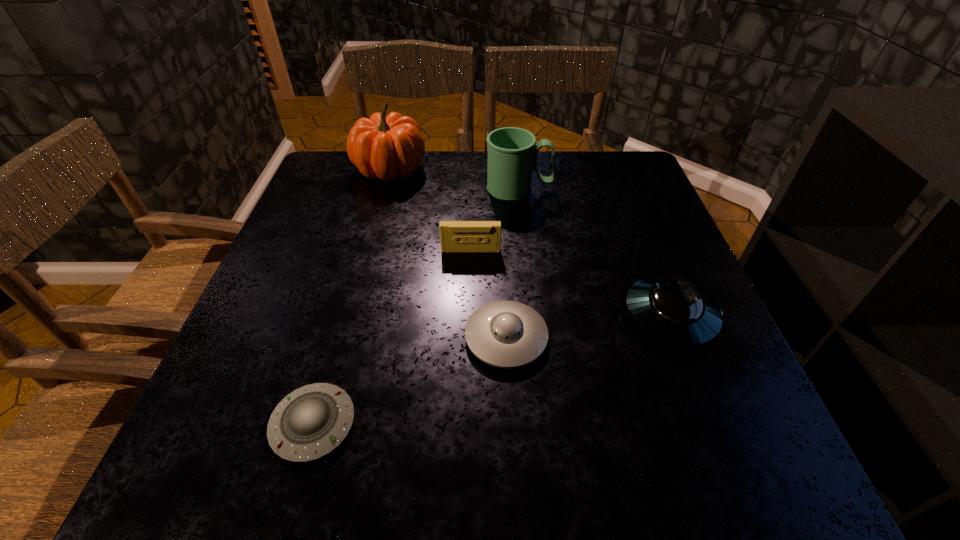
Find the location of a particular element. The width and height of the screenshot is (960, 540). saucer located at the left edge is located at coordinates (310, 422).

Where is `object positioned at the right edge`? This screenshot has height=540, width=960. object positioned at the right edge is located at coordinates (673, 309).

The height and width of the screenshot is (540, 960). I want to click on object present at the far left corner, so click(x=382, y=147).

This screenshot has height=540, width=960. I want to click on object that is positioned at the near left corner, so click(x=310, y=422).

Locate an element on the screen. vacant area at the far edge of the desktop is located at coordinates (548, 188).

The image size is (960, 540). I want to click on vacant space at the left edge, so click(x=360, y=220).

Where is `blank space at the right edge of the desktop`? blank space at the right edge of the desktop is located at coordinates (632, 260).

Find the location of a particular element. Image resolution: width=960 pixels, height=540 pixels. vacant position at the far left corner of the desktop is located at coordinates (325, 181).

Identify the location of free space at the near left corner of the desktop. (217, 438).

Locate an element on the screen. This screenshot has width=960, height=540. free space at the far right corner of the desktop is located at coordinates (634, 166).